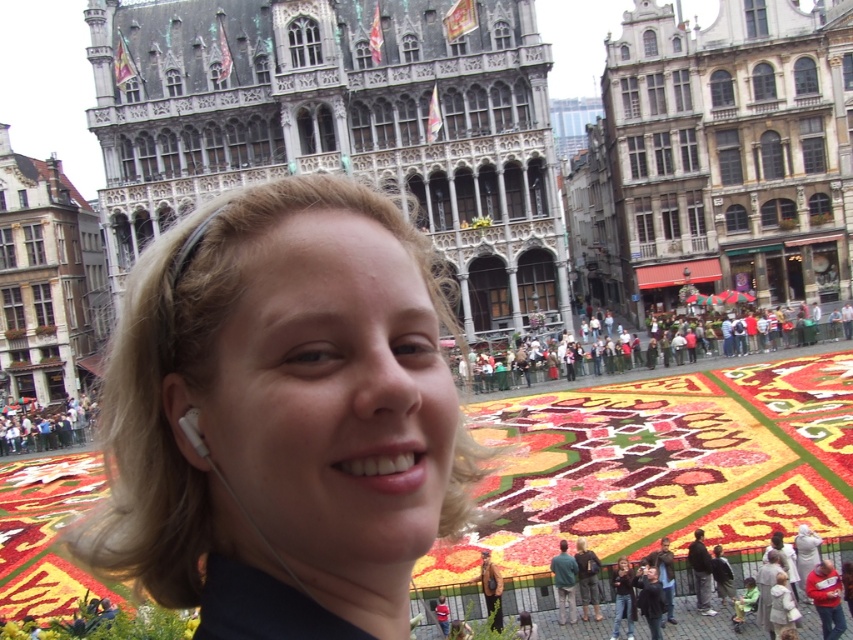
Is blonde hair at center thinner than dark gray stone building at upper center?

Yes.

Between point (154, 304) and point (358, 109), which one is positioned in front?

Point (154, 304)

This screenshot has height=640, width=853. I want to click on blonde hair at center, so click(x=281, y=413).

Who is lower down, stone building at center or white earphone at lower left?

white earphone at lower left

Is stone building at center above white earphone at lower left?

Correct, stone building at center is located above white earphone at lower left.

Which is in front, point (755, 236) or point (180, 420)?

Point (180, 420) is more forward.

Locate an element on the screen. stone building at center is located at coordinates (732, 150).

Does blonde hair at center have a lesser width compared to brown stone building at left?

Incorrect, blonde hair at center's width is not less than brown stone building at left's.

Which of these two, blonde hair at center or brown stone building at left, stands shorter?

blonde hair at center

Which is in front, point (461, 513) or point (16, 221)?

Point (461, 513) is in front.

Locate an element on the screen. The width and height of the screenshot is (853, 640). blonde hair at center is located at coordinates (281, 413).